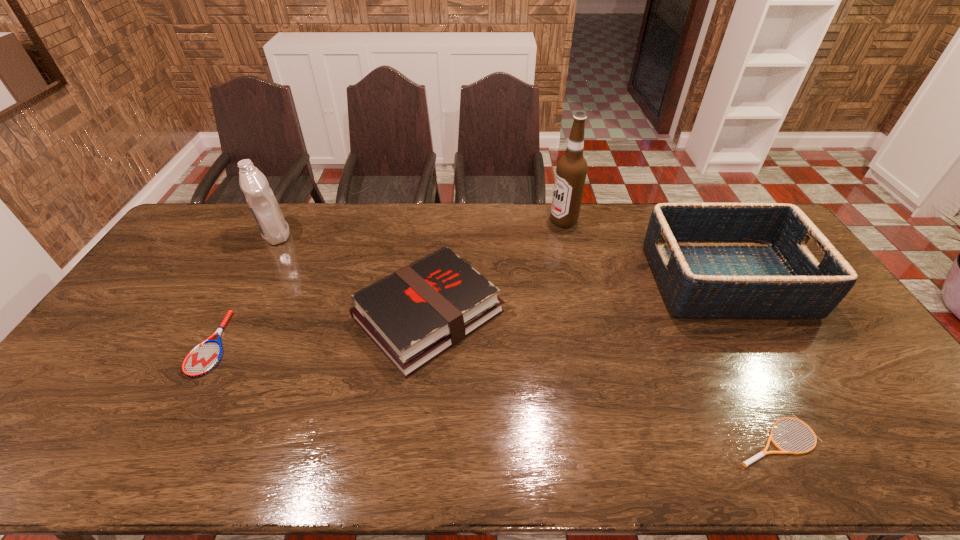
Where is `vacant area that satisfies the following two spatial constraints: 1. on the label of the alcohol; 2. on the front side of the detergent`? vacant area that satisfies the following two spatial constraints: 1. on the label of the alcohol; 2. on the front side of the detergent is located at coordinates (566, 234).

The height and width of the screenshot is (540, 960). Identify the location of free location that satisfies the following two spatial constraints: 1. on the back side of the farther tennis racket; 2. on the right side of the second tallest object. 272,234.

Identify the location of vacant space that satisfies the following two spatial constraints: 1. on the label of the alcohol; 2. on the back side of the nearer tennis racket. (612, 440).